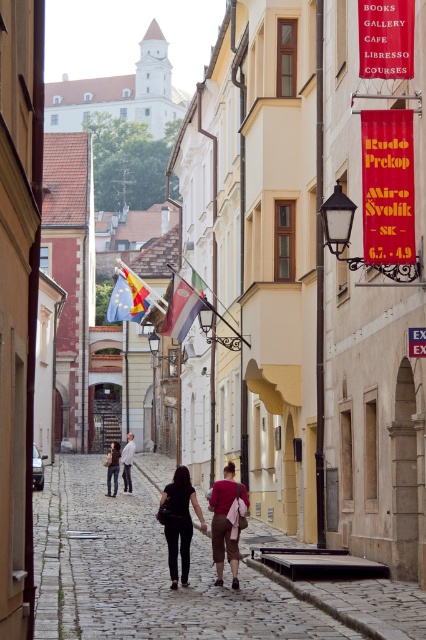
Question: Is polished wood flag at center bigger than european union flag at center?

Choices:
 (A) yes
 (B) no

Answer: (A)

Question: Which object is closer to the camera taking this photo?

Choices:
 (A) dark brown leather pants at center
 (B) european union flag at center
 (C) dark brown leather jacket at center
 (D) cobblestone alley at center

Answer: (D)

Question: Which of the following is the farthest from the observer?

Choices:
 (A) european union flag at center
 (B) dark brown leather pants at center

Answer: (A)

Question: Can you confirm if cobblestone alley at center is smaller than polished wood flag at center?

Choices:
 (A) yes
 (B) no

Answer: (B)

Question: Which point is farther from the camera taking this photo?

Choices:
 (A) (89, 596)
 (B) (201, 513)
 (C) (141, 300)
 (D) (178, 280)

Answer: (C)

Question: Is dark brown leather pants at center to the right of polished wood flag at center from the viewer's perspective?

Choices:
 (A) yes
 (B) no

Answer: (A)